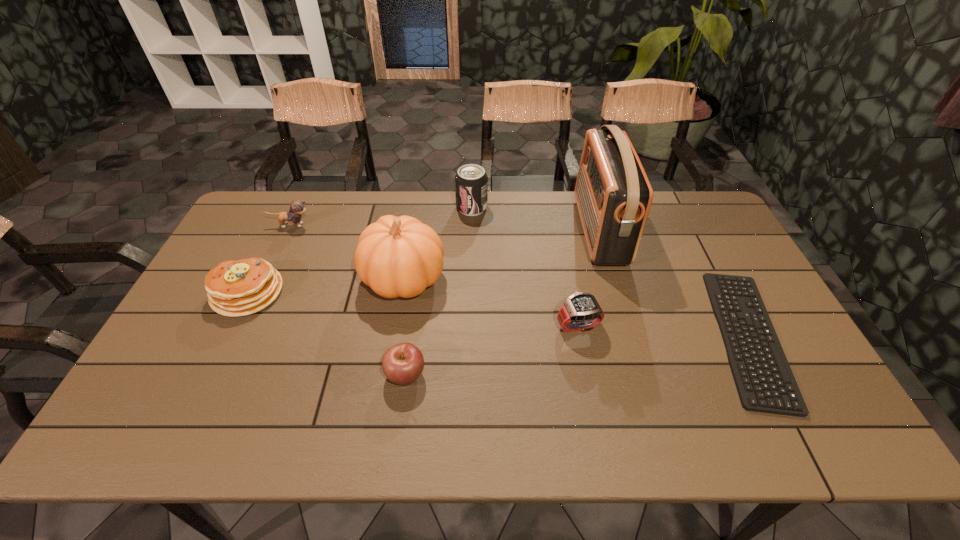
Image resolution: width=960 pixels, height=540 pixels. I want to click on free space at the far edge, so click(331, 212).

At what (x,y) coordinates should I click in order to perform the action: click on vacant region at the near edge of the desktop. Please return your answer as a coordinate pair (x, y). This screenshot has height=540, width=960. Looking at the image, I should click on (546, 444).

This screenshot has width=960, height=540. In order to click on vacant area at the left edge of the desktop in this screenshot , I will do `click(222, 328)`.

I want to click on vacant space at the right edge of the desktop, so click(x=687, y=236).

I want to click on vacant region at the far left corner of the desktop, so click(276, 193).

In the image, there is a desktop. Where is `vacant space at the near left corner`? vacant space at the near left corner is located at coordinates (136, 443).

In the image, there is a desktop. At what (x,y) coordinates should I click in order to perform the action: click on free space at the far right corner. Please return your answer as a coordinate pair (x, y). This screenshot has height=540, width=960. Looking at the image, I should click on (683, 193).

Identify the location of empty space that is in between the kitten and the soda can. (381, 217).

Identify the location of free space between the kitten and the second object from right to left. This screenshot has height=540, width=960. (445, 228).

In order to click on free space between the sixth object from left to right and the seventh tallest object in this screenshot , I will do `click(492, 349)`.